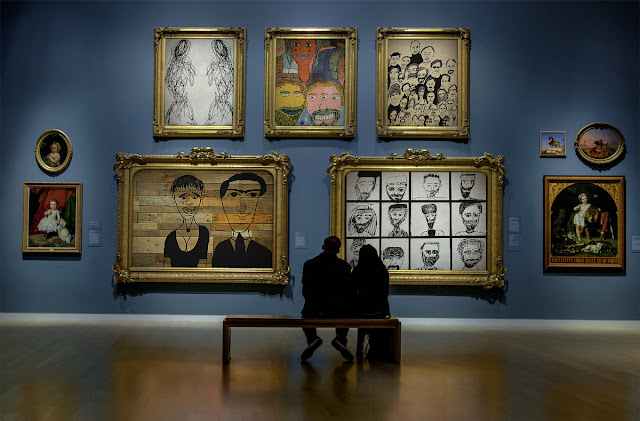
Where is `floor`? This screenshot has width=640, height=421. floor is located at coordinates (177, 389).